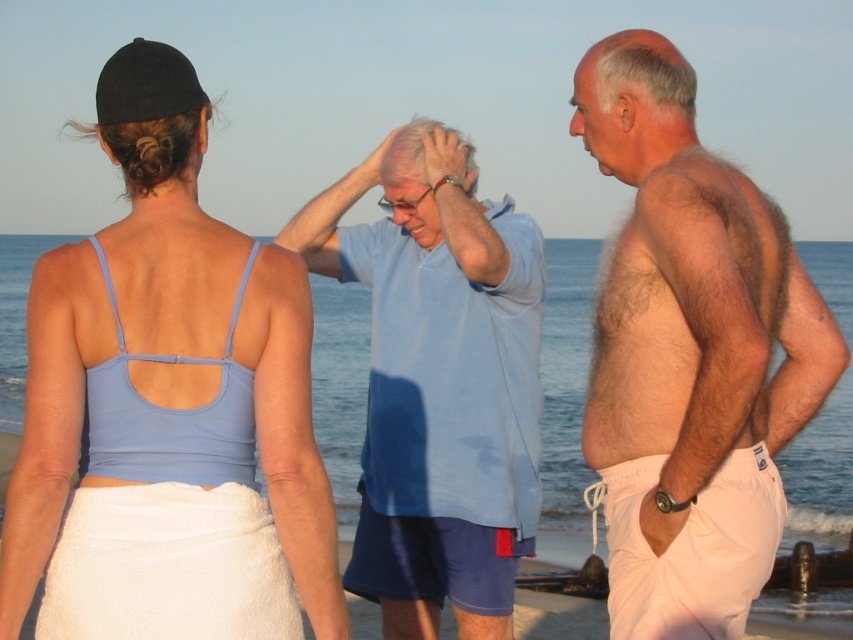
Does beige cotton shorts at right appear on the right side of light blue cotton shirt at center?

Yes, beige cotton shorts at right is to the right of light blue cotton shirt at center.

Who is positioned more to the right, beige cotton shorts at right or light blue cotton shirt at center?

beige cotton shorts at right is more to the right.

Locate an element on the screen. beige cotton shorts at right is located at coordinates (689, 353).

Identify the location of beige cotton shorts at right. (689, 353).

Is matte blue tank top at center to the left of beige cotton shorts at right from the viewer's perspective?

Correct, you'll find matte blue tank top at center to the left of beige cotton shorts at right.

Which is behind, point (97, 113) or point (636, 464)?

The point (636, 464) is behind.

Is point (308, 385) positioned in front of point (766, 252)?

Yes, it is in front of point (766, 252).

Locate an element on the screen. The height and width of the screenshot is (640, 853). matte blue tank top at center is located at coordinates (170, 401).

Is matte blue tank top at center taller than light blue cotton shirt at center?

In fact, matte blue tank top at center may be shorter than light blue cotton shirt at center.

Locate an element on the screen. This screenshot has width=853, height=640. matte blue tank top at center is located at coordinates (170, 401).

Where is `matte blue tank top at center`? matte blue tank top at center is located at coordinates (170, 401).